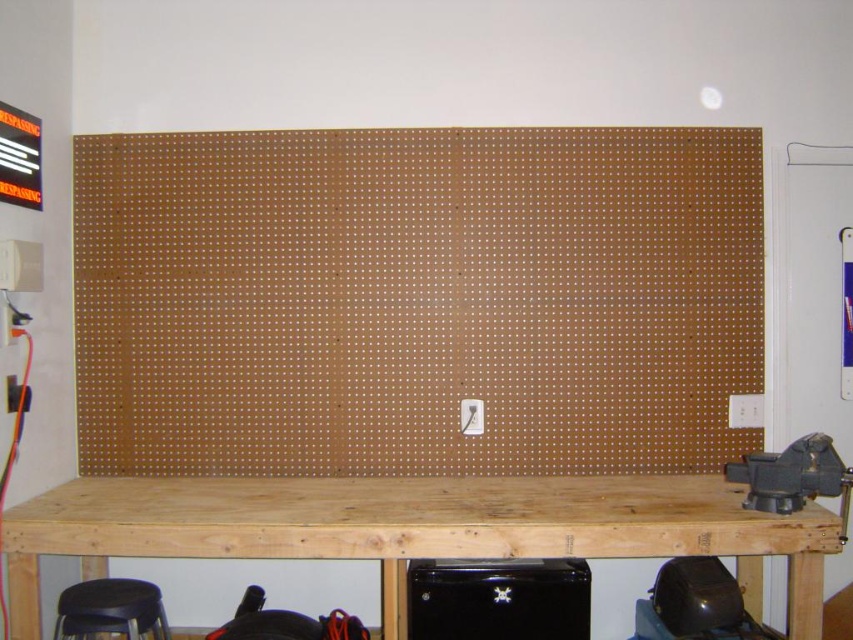
You are organizing tools in a workshop and need to place a heavy tool on the surface below the brown pegboard at center. Is there enough space on the natural wood table at center to place it without it hanging over the edge?

The brown pegboard at center is positioned over the natural wood table at center. Since the pegboard is directly above the table, the table should provide sufficient space to place the tool without overhang, as it aligns under the pegboard.

Looking at this image, you are organizing tools in the workshop and need to place a large tool box. The brown pegboard at center and the black matte stool at lower left are both potential spots. Which object can accommodate the larger item based on their sizes?

The brown pegboard at center is bigger than the black matte stool at lower left, so the brown pegboard at center can accommodate the larger item.

Looking at this image, you are a carpenter standing in front of the workshop. You need to move the black matte stool at lower left closer to the brown pegboard at center. Which direction should you move it to ensure it gets closer to the pegboard?

The brown pegboard at center is further to the viewer than the black matte stool at lower left. To move the stool closer to the pegboard, you should move it forward towards the pegboard.